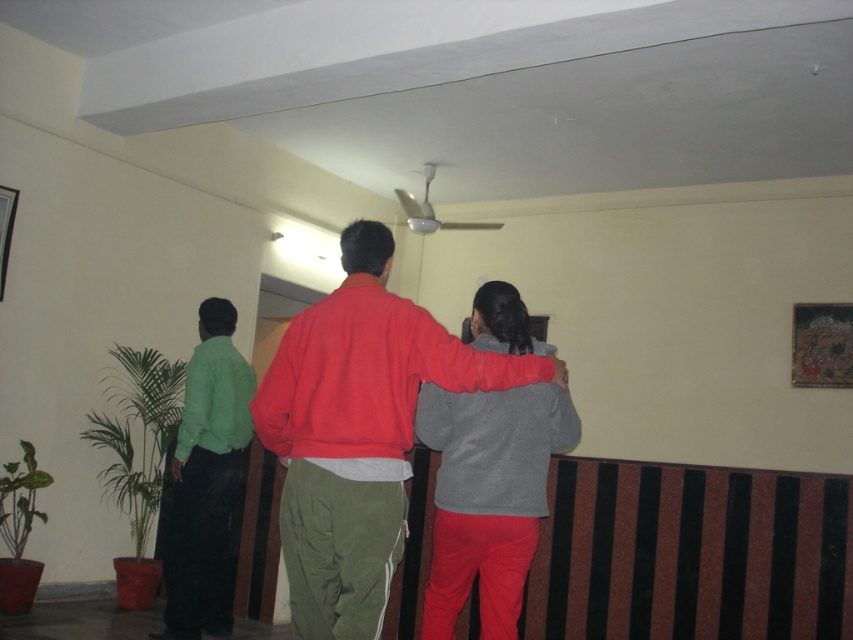
Question: Which object appears closest to the camera in this image?

Choices:
 (A) green fabric shirt at left
 (B) red matte sweatshirt at center

Answer: (B)

Question: Is red matte sweatshirt at center further to the viewer compared to green fabric shirt at left?

Choices:
 (A) yes
 (B) no

Answer: (B)

Question: Is red matte sweatshirt at center further to camera compared to green fabric shirt at left?

Choices:
 (A) yes
 (B) no

Answer: (B)

Question: Is red matte sweatshirt at center behind green fabric shirt at left?

Choices:
 (A) yes
 (B) no

Answer: (B)

Question: Which object appears farthest from the camera in this image?

Choices:
 (A) green fabric shirt at left
 (B) red matte sweatshirt at center

Answer: (A)